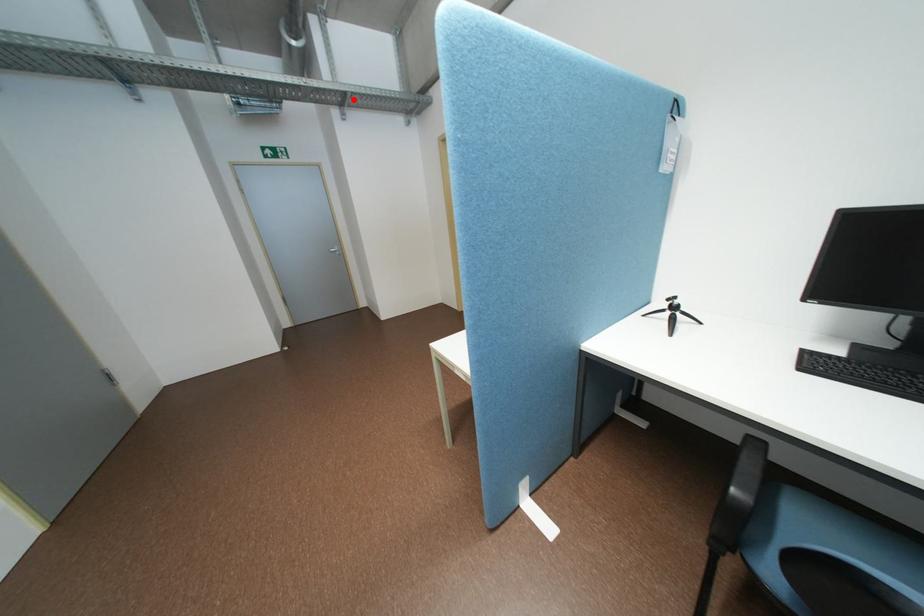
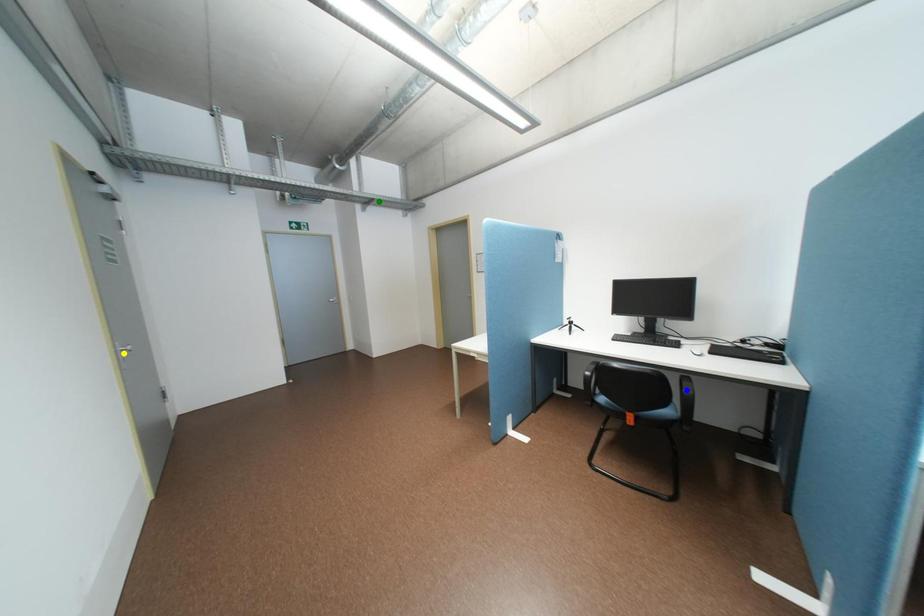
Question: I am providing you with two images of the same scene from different viewpoints. A red point is marked on the first image. You are given multiple points on the second image. Which point in image 2 is actually the same real-world point as the red point in image 1?

Choices:
 (A) green point
 (B) yellow point
 (C) blue point

Answer: (A)